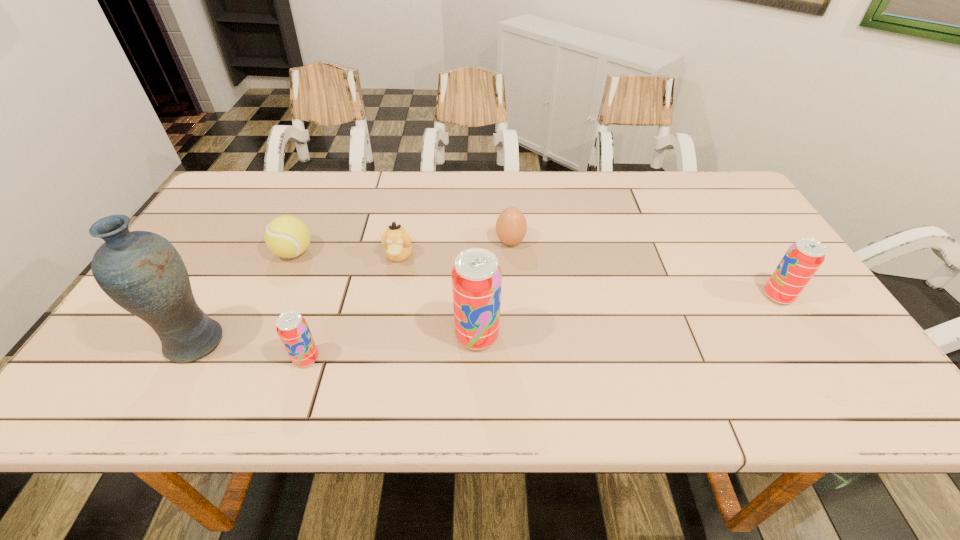
This screenshot has width=960, height=540. Find the location of `free spot that satisfies the following two spatial constraints: 1. on the back side of the sixth shortest object; 2. on the right side of the second shortest soda can`. free spot that satisfies the following two spatial constraints: 1. on the back side of the sixth shortest object; 2. on the right side of the second shortest soda can is located at coordinates (477, 296).

Image resolution: width=960 pixels, height=540 pixels. In order to click on vacant region that satisfies the following two spatial constraints: 1. on the front side of the tennis ball; 2. on the left side of the second soda can from right to left in this screenshot , I will do `click(257, 336)`.

This screenshot has width=960, height=540. In order to click on free space that satisfies the following two spatial constraints: 1. on the back side of the second tallest soda can; 2. on the right side of the shortest soda can in this screenshot , I will do `click(327, 296)`.